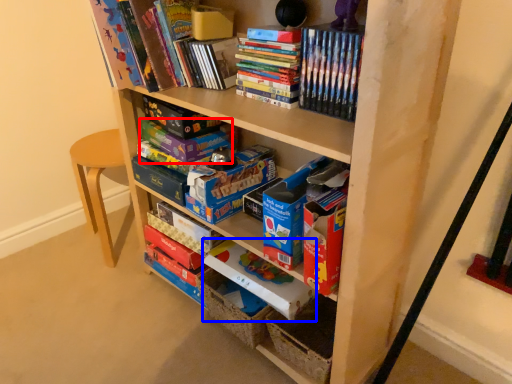
Question: Which object is closer to the camera taking this photo, paperback book (highlighted by a red box) or paperback book (highlighted by a blue box)?

Choices:
 (A) paperback book
 (B) paperback book

Answer: (B)